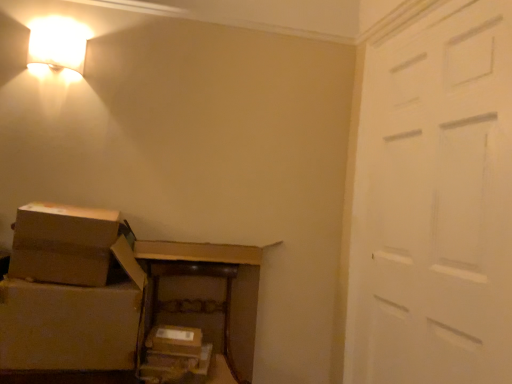
Question: From a real-world perspective, is white matte door at right positioned above or below brown cardboard box at lower left, marked as the 1th box in a top-to-bottom arrangement?

Choices:
 (A) below
 (B) above

Answer: (B)

Question: Is white matte door at right to the left or to the right of brown cardboard box at lower left, marked as the 1th box in a top-to-bottom arrangement, in the image?

Choices:
 (A) left
 (B) right

Answer: (B)

Question: Estimate the real-world distances between objects in this image. Which object is farther from the matte white wall sconce at upper left?

Choices:
 (A) white matte door at right
 (B) brown cardboard box at lower center, marked as the 1th storage box in a bottom-to-top arrangement
 (C) brown cardboard box at lower center, which is the 1th storage box from top to bottom
 (D) brown cardboard box at lower left, marked as the second box in a bottom-to-top arrangement
 (E) brown cardboard boxes at lower center

Answer: (A)

Question: Estimate the real-world distances between objects in this image. Which object is farther from the white matte door at right?

Choices:
 (A) brown cardboard box at lower center, marked as the 1th storage box in a bottom-to-top arrangement
 (B) brown cardboard box at lower left, marked as the second box in a bottom-to-top arrangement
 (C) matte white wall sconce at upper left
 (D) brown cardboard box at lower center, which is the 1th storage box from top to bottom
 (E) brown cardboard boxes at lower center

Answer: (C)